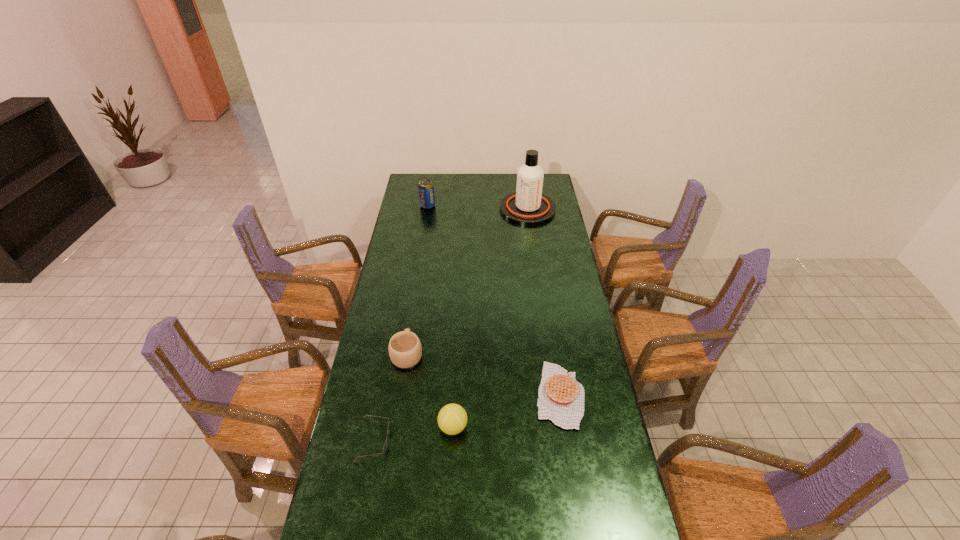
The width and height of the screenshot is (960, 540). Identify the location of vacant space located 0.270m on the side of the mug with the handle. (417, 291).

Where is `vacant region located 0.120m on the side of the mug with the handle`? vacant region located 0.120m on the side of the mug with the handle is located at coordinates (413, 316).

Locate an element on the screen. vacant space located 0.180m on the front of the pie is located at coordinates click(574, 487).

The height and width of the screenshot is (540, 960). In order to click on vacant position located 0.090m on the lenses of the sunglasses in this screenshot , I will do [x=418, y=440].

At what (x,y) coordinates should I click in order to perform the action: click on object positioned at the far edge. Please return your answer as a coordinate pair (x, y). The image size is (960, 540). Looking at the image, I should click on (528, 206).

Locate an element on the screen. soda that is positioned at the left edge is located at coordinates (425, 187).

Find the location of `mug situated at the left edge`. mug situated at the left edge is located at coordinates (405, 351).

Locate an element on the screen. sunglasses at the left edge is located at coordinates (386, 441).

At what (x,y) coordinates should I click in order to perform the action: click on cleansing agent located in the right edge section of the desktop. Please return your answer as a coordinate pair (x, y). This screenshot has height=540, width=960. Looking at the image, I should click on (528, 206).

Where is `pie that is at the right edge`? The width and height of the screenshot is (960, 540). pie that is at the right edge is located at coordinates (560, 397).